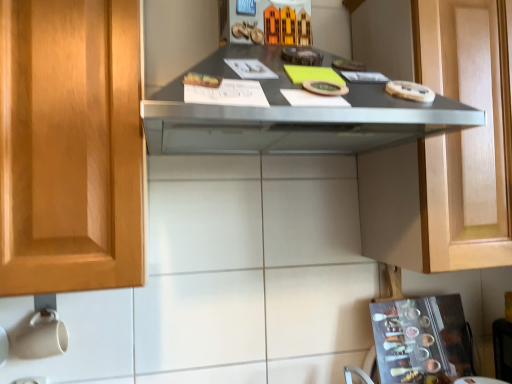
Question: From the image's perspective, is matte gray countertop at center located above or below matte wood cabinet at upper right?

Choices:
 (A) below
 (B) above

Answer: (B)

Question: From a real-world perspective, relative to matte wood cabinet at upper right, is matte gray countertop at center vertically above or below?

Choices:
 (A) below
 (B) above

Answer: (B)

Question: Which object is the closest to the matte wood cabinet at upper right?

Choices:
 (A) metallic silver spice rack at lower right
 (B) matte gray countertop at center

Answer: (B)

Question: Which object is positioned closest to the matte gray countertop at center?

Choices:
 (A) metallic silver spice rack at lower right
 (B) matte wood cabinet at upper right

Answer: (B)